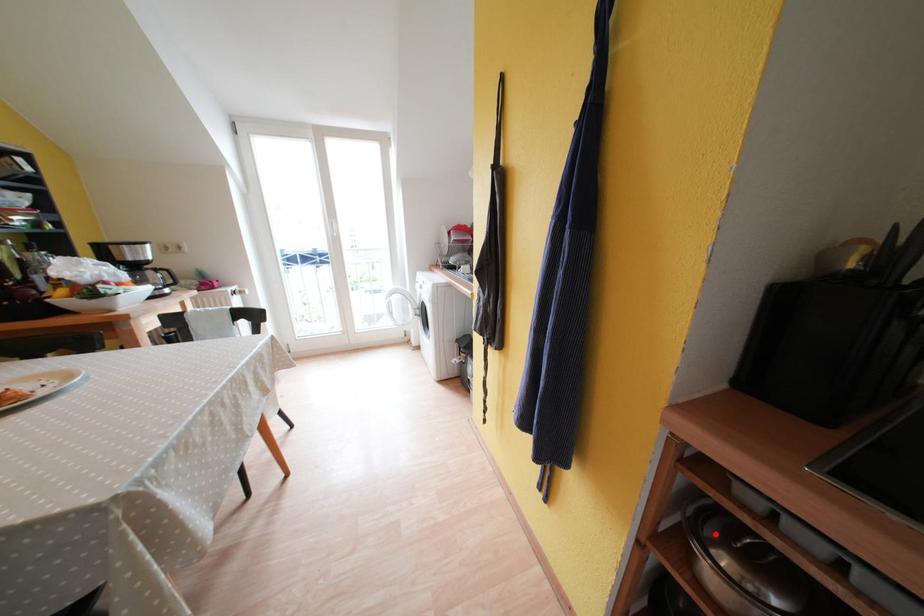
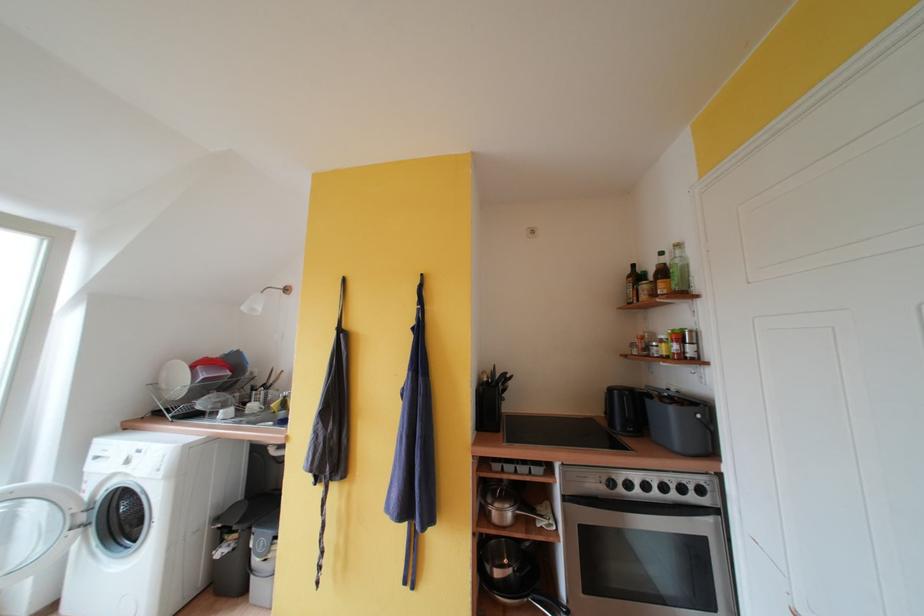
The point at the highlighted location is marked in the first image. Where is the corresponding point in the second image?

(495, 504)